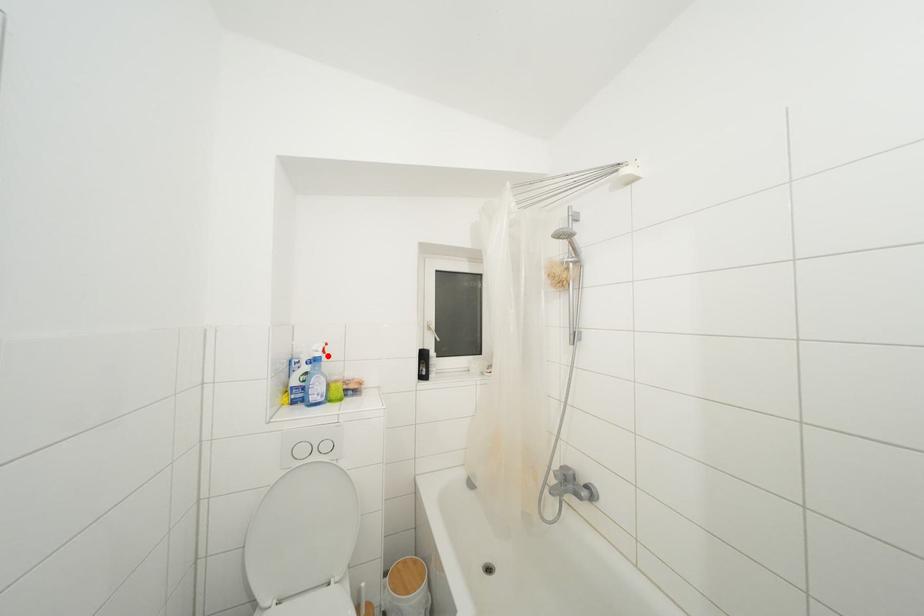
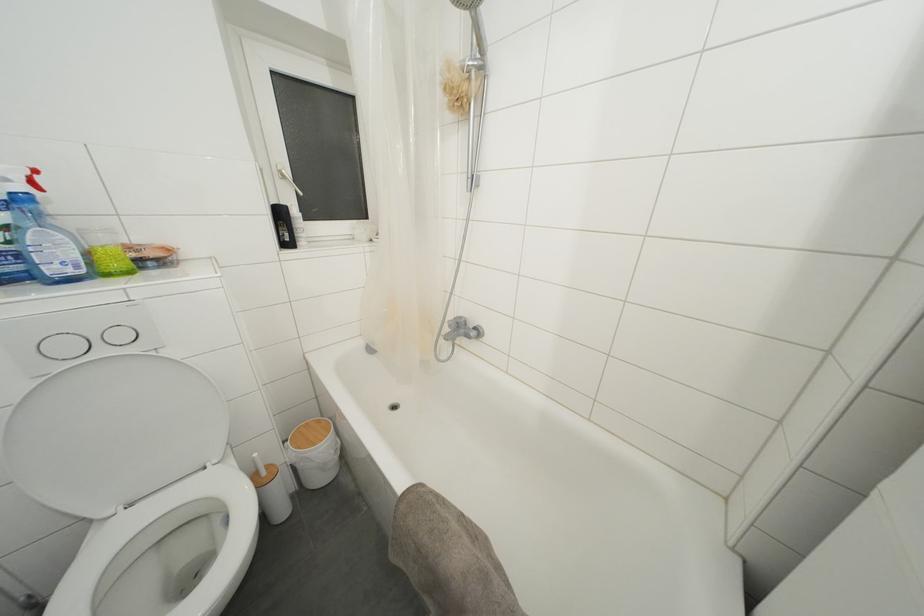
In the second image, find the point that corresponds to the highlighted location in the first image.

(37, 188)